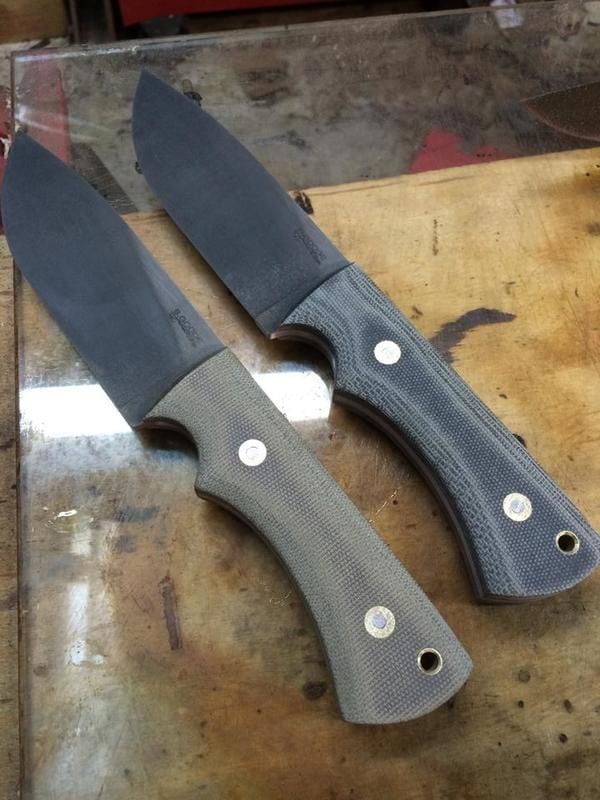
Identify the location of counter. The image size is (600, 800). (88, 125), (17, 734).